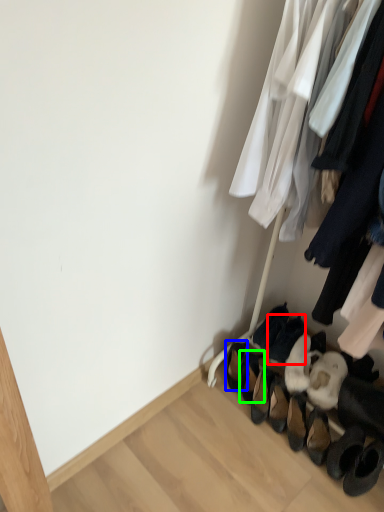
Question: Considering the real-world distances, which object is closest to footwear (highlighted by a red box)? footwear (highlighted by a blue box) or footwear (highlighted by a green box).

Choices:
 (A) footwear
 (B) footwear

Answer: (B)